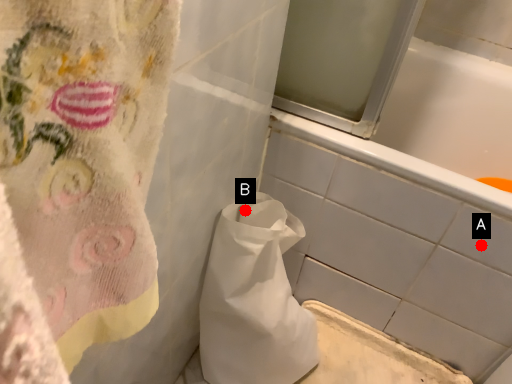
Question: Two points are circled on the image, labeled by A and B beside each circle. Which point is closer to the camera?

Choices:
 (A) A is closer
 (B) B is closer

Answer: (A)